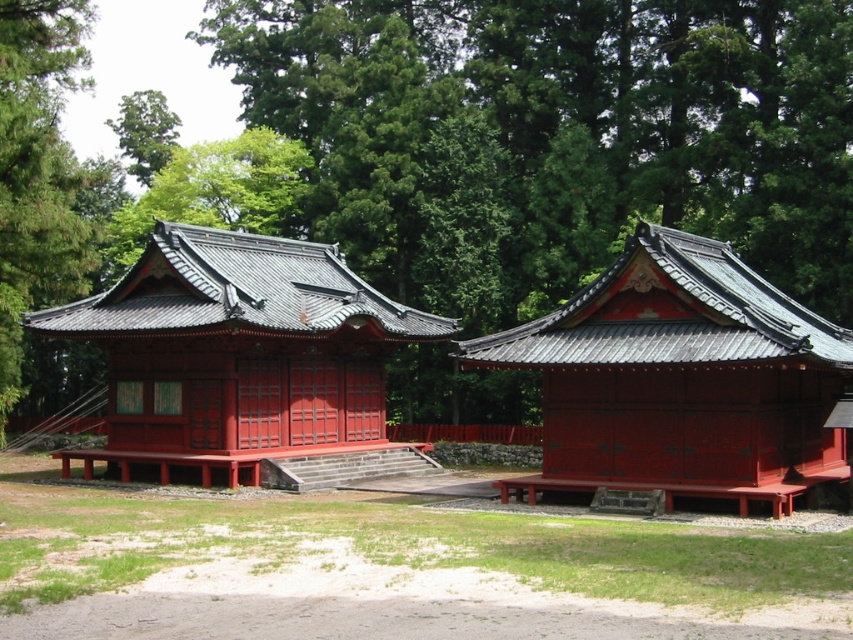
You are standing in the forest and see the shiny red wood gazebo at center and the shiny lacquered shrine at center. Which one is positioned to the right?

The shiny red wood gazebo at center is positioned to the right of the shiny lacquered shrine at center.

You are planning to install a new lighting system for the shiny red wood gazebo at center. You want to ensure that the lights will not be blocked by the green leafy tree at upper center. Based on the scene description, will the tree block the lights if they are placed at the top of the gazebo?

The green leafy tree at upper center is taller than the shiny red wood gazebo at center. Therefore, if the lights are placed at the top of the gazebo, the tree might block them since the tree is taller and positioned above the gazebo.

You are standing in front of the two traditional Japanese buildings in the forest. You notice two points marked in the scene. The first point is at coordinate point (744,160), and the second is at point (660,346). Which point is closer to you?

Point (744,160) is further to the camera than point (660,346), so the point closer to you is point (660,346).